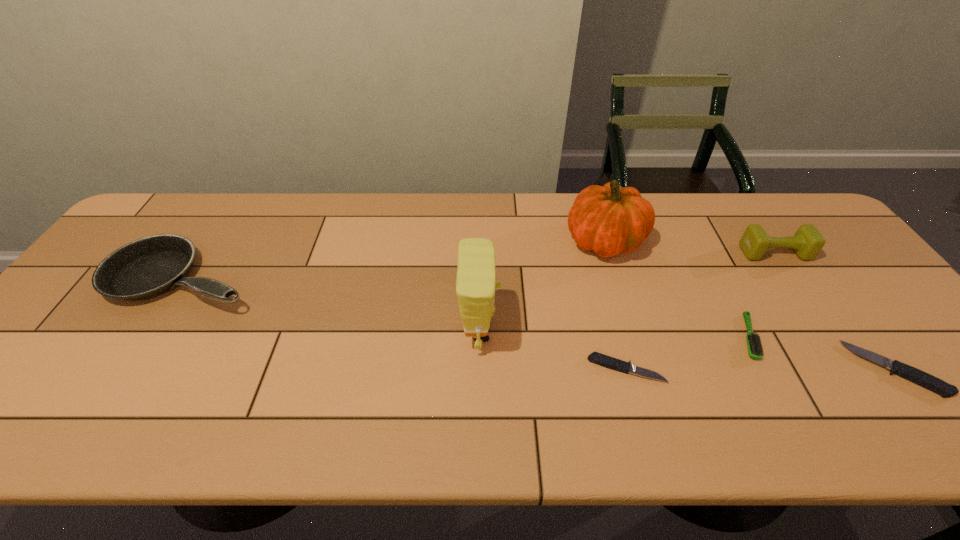
Where is `the shortest object`? Image resolution: width=960 pixels, height=540 pixels. the shortest object is located at coordinates (603, 360).

Identify the location of the shorter steak knife. [603, 360].

This screenshot has height=540, width=960. In order to click on the right steak knife in this screenshot , I will do `click(912, 374)`.

Where is `the taller steak knife`? This screenshot has height=540, width=960. the taller steak knife is located at coordinates (912, 374).

I want to click on pumpkin, so click(609, 219).

What are the coordinates of `dumbbell` in the screenshot? It's located at (x=807, y=242).

Find the location of a particular element. The height and width of the screenshot is (540, 960). frying pan is located at coordinates (150, 266).

Find the location of a particular element. This screenshot has height=540, width=960. the sixth object from right to left is located at coordinates (475, 282).

Identify the location of the third shortest object. (754, 344).

Locate an element on the screen. The image size is (960, 540). hairbrush is located at coordinates (754, 344).